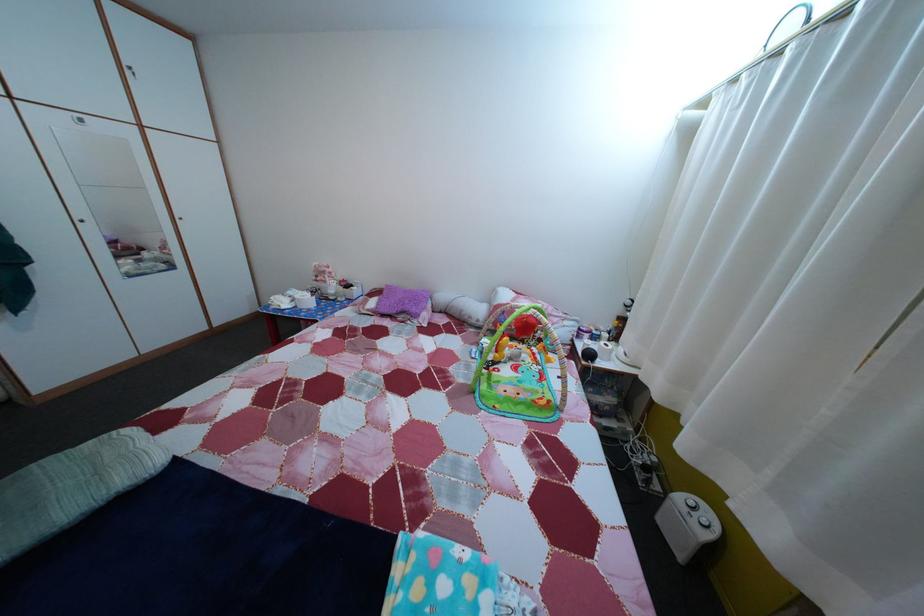
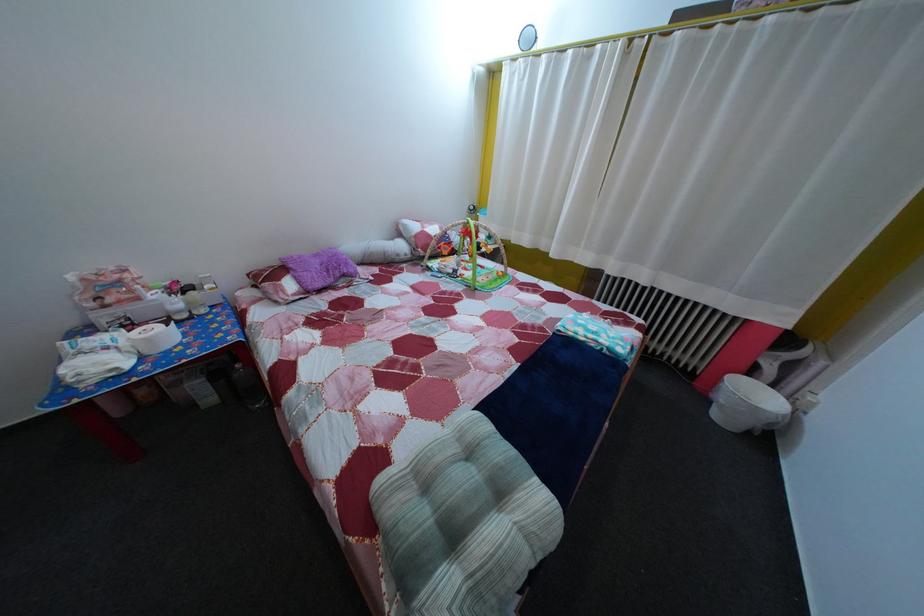
The point at (209, 451) is marked in the first image. Where is the corresponding point in the second image?

(442, 432)